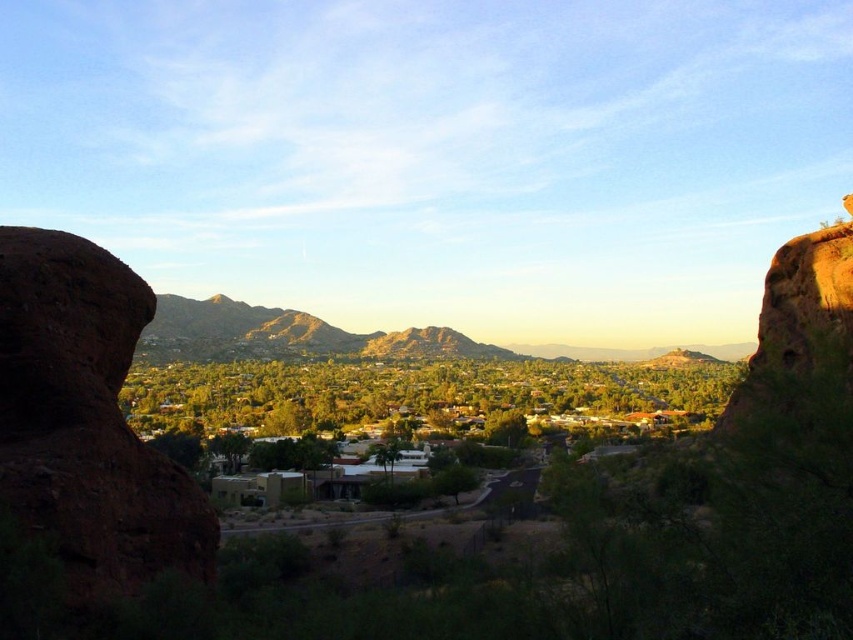
Between green grassy valley at center and rustic brown mountain at center, which one has more height?

With more height is rustic brown mountain at center.

Can you confirm if green grassy valley at center is positioned to the left of rustic brown mountain at center?

Yes, green grassy valley at center is to the left of rustic brown mountain at center.

Is point (668, 362) behind point (155, 349)?

That is True.

The image size is (853, 640). Identify the location of green grassy valley at center. (421, 396).

Can you confirm if brown rough rock at left is shorter than green grassy valley at center?

Correct, brown rough rock at left is not as tall as green grassy valley at center.

Looking at this image, can you confirm if brown rough rock at left is smaller than green grassy valley at center?

Yes, brown rough rock at left is smaller than green grassy valley at center.

Does point (94, 403) come farther from viewer compared to point (262, 404)?

No.

I want to click on brown rough rock at left, so click(x=86, y=424).

Does brown rough rock at left appear under rustic brown mountain at center?

No.

Between brown rough rock at left and rustic brown mountain at center, which one appears on the left side from the viewer's perspective?

From the viewer's perspective, brown rough rock at left appears more on the left side.

Is point (84, 483) positioned in front of point (573, 346)?

That is True.

The height and width of the screenshot is (640, 853). I want to click on brown rough rock at left, so click(x=86, y=424).